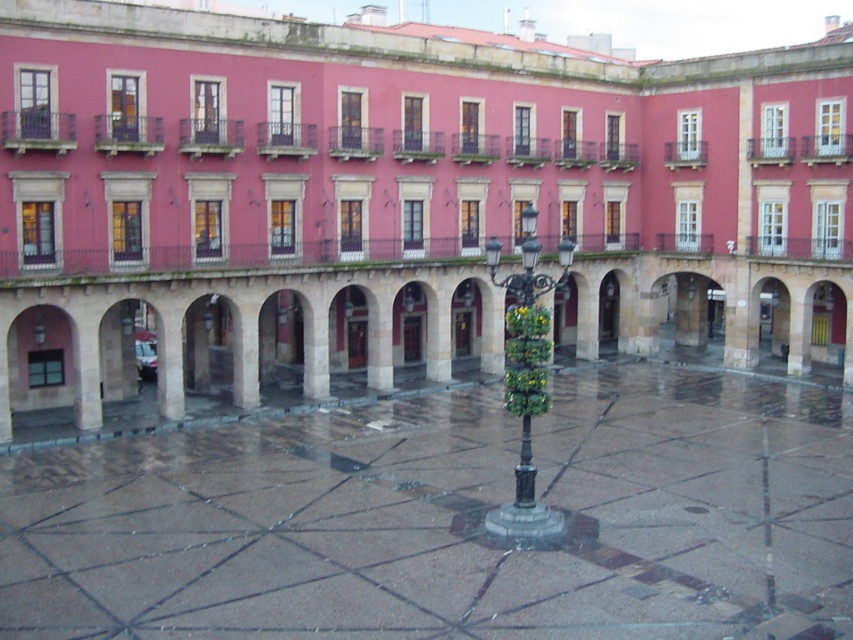
Does polished stone courtyard at center have a greater height compared to black metal streetlamp at center?

No.

Image resolution: width=853 pixels, height=640 pixels. Find the location of `polished stone courtyard at center`. polished stone courtyard at center is located at coordinates (450, 518).